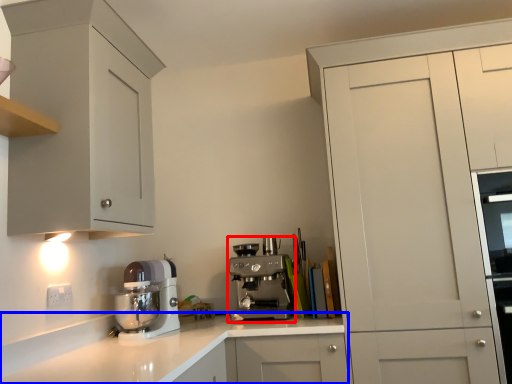
Question: Which object is closer to the camera taking this photo, kitchen appliance (highlighted by a red box) or countertop (highlighted by a blue box)?

Choices:
 (A) kitchen appliance
 (B) countertop

Answer: (B)